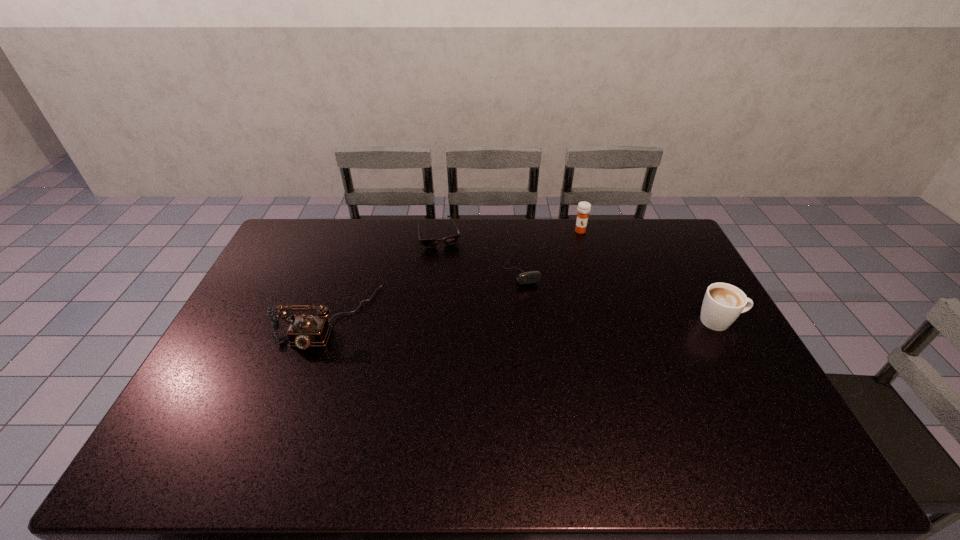
You are a GUI agent. You are given a task and a screenshot of the screen. Output one action in this format:
    pyautogui.click(x=<x>, y=<y>)
    Task: Click on the leftmost object
    The image size is (960, 540).
    Given the screenshot: What is the action you would take?
    pyautogui.click(x=304, y=331)

The image size is (960, 540). Identify the location of the rightmost object. (723, 303).

Image resolution: width=960 pixels, height=540 pixels. I want to click on the third object from right to left, so click(x=531, y=277).

This screenshot has height=540, width=960. I want to click on webcam, so click(531, 277).

Locate an element on the screen. the second object from right to left is located at coordinates click(584, 208).

Identify the location of the second object from left to right. The height and width of the screenshot is (540, 960). (432, 242).

Where is `sunglasses`? This screenshot has height=540, width=960. sunglasses is located at coordinates (432, 242).

Find the location of `vacant region located 0.150m on the dial of the telephone`. vacant region located 0.150m on the dial of the telephone is located at coordinates (300, 400).

Image resolution: width=960 pixels, height=540 pixels. In order to click on vacant area situated 0.130m on the front-facing side of the webcam in this screenshot , I will do `click(539, 316)`.

Where is `free region located on the front-facing side of the webcam`? The width and height of the screenshot is (960, 540). free region located on the front-facing side of the webcam is located at coordinates (540, 319).